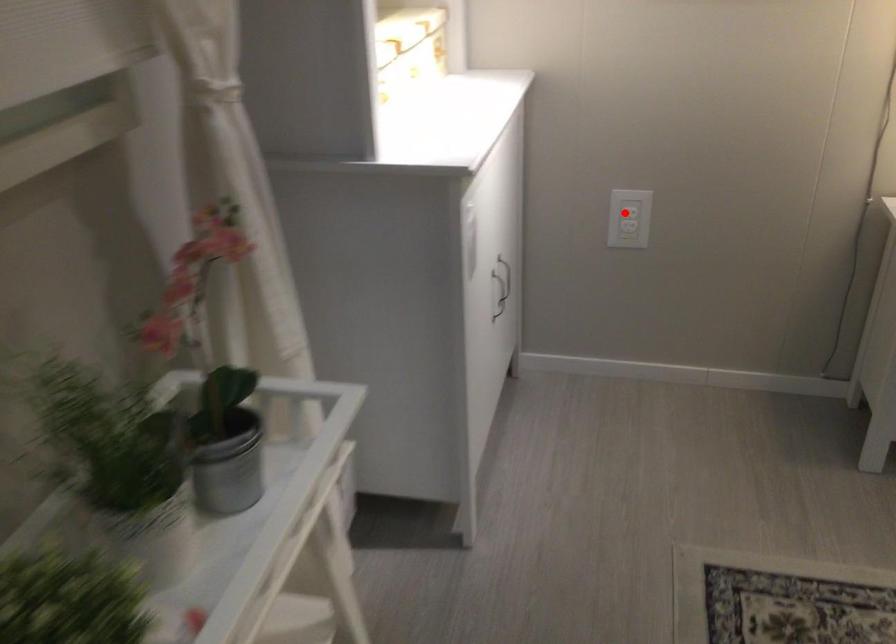
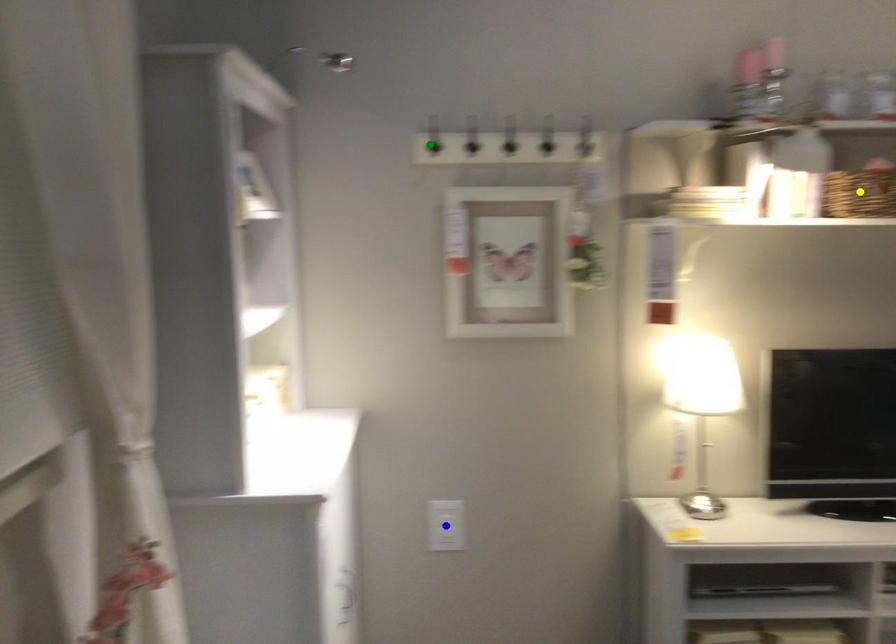
Question: I am providing you with two images of the same scene from different viewpoints. A red point is marked on the first image. You are given multiple points on the second image. Which point in image 2 is actually the same real-world point as the red point in image 1?

Choices:
 (A) blue point
 (B) green point
 (C) yellow point

Answer: (A)